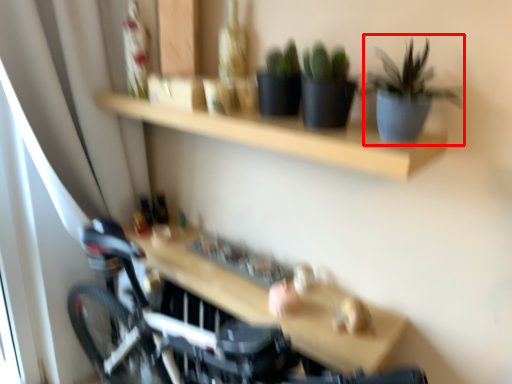
Question: From the image, what is the correct spatial relationship of houseplant (annotated by the red box) in relation to table?

Choices:
 (A) right
 (B) left

Answer: (A)